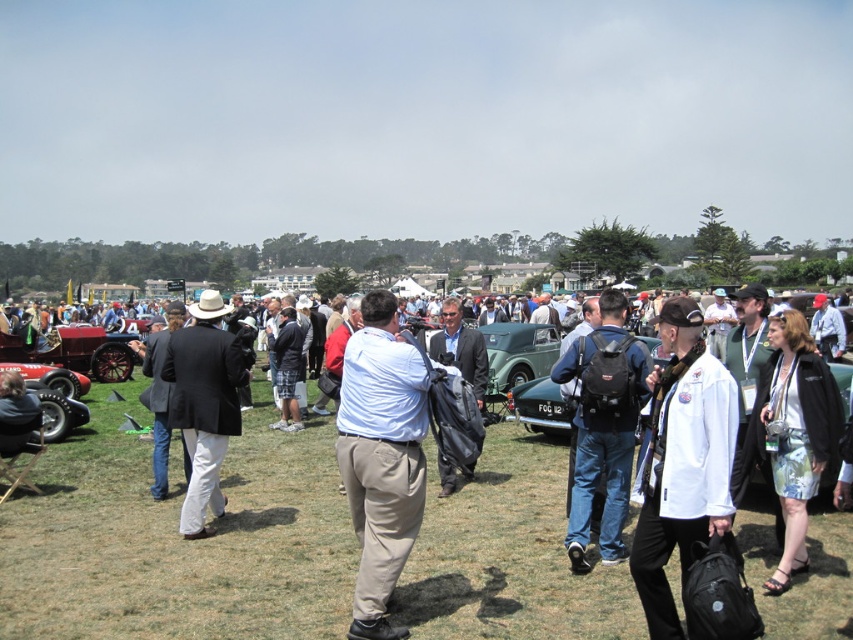
Question: Is floral skirt at center wider than black wool suit at center?

Choices:
 (A) yes
 (B) no

Answer: (B)

Question: From the image, what is the correct spatial relationship of black wool suit at center in relation to green matte car at center?

Choices:
 (A) right
 (B) left

Answer: (B)

Question: Which point is farther to the camera?

Choices:
 (A) (409, 452)
 (B) (474, 330)

Answer: (B)

Question: Which of the following is the closest to the observer?

Choices:
 (A) white uniform at center
 (B) green fabric jacket at center
 (C) matte black backpack at center
 (D) green matte car at center

Answer: (B)

Question: Which of the following is the closest to the observer?

Choices:
 (A) light blue shirt at center
 (B) green fabric jacket at center
 (C) matte black backpack at center

Answer: (B)

Question: Does light blue shirt at center have a greater width compared to green fabric jacket at center?

Choices:
 (A) yes
 (B) no

Answer: (B)